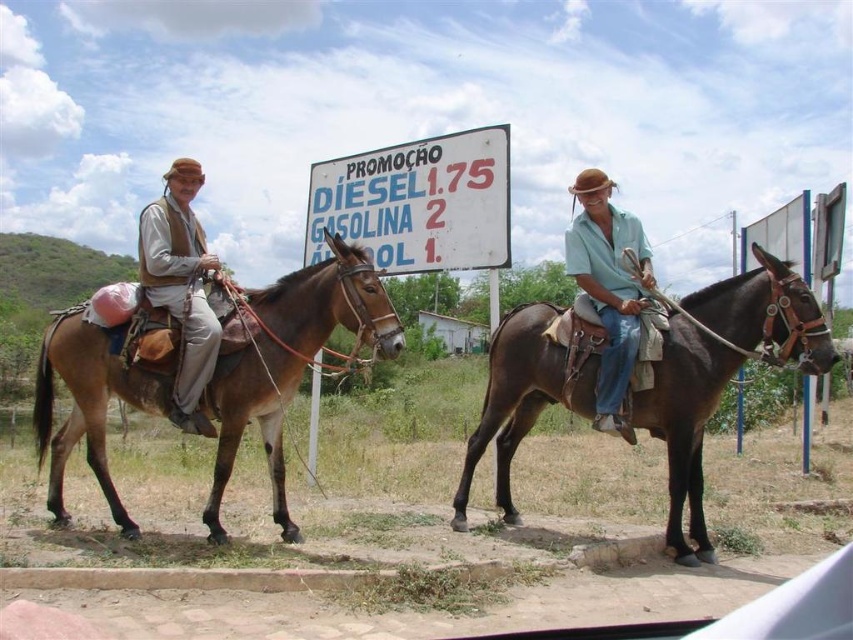
Who is more forward, (802, 308) or (142, 264)?

A: Point (802, 308) is in front.

The image size is (853, 640). I want to click on brown leather mule at center, so click(521, 397).

Who is shorter, white paper sign at center or matte teal shirt at center?

white paper sign at center

Does white paper sign at center have a greater height compared to matte teal shirt at center?

Incorrect, white paper sign at center's height is not larger of matte teal shirt at center's.

The height and width of the screenshot is (640, 853). What are the coordinates of `white paper sign at center` in the screenshot? It's located at (416, 202).

Who is shorter, white paper sign at center or brown leather vest at left?

With less height is white paper sign at center.

This screenshot has width=853, height=640. What do you see at coordinates (416, 202) in the screenshot? I see `white paper sign at center` at bounding box center [416, 202].

What are the coordinates of `white paper sign at center` in the screenshot? It's located at (416, 202).